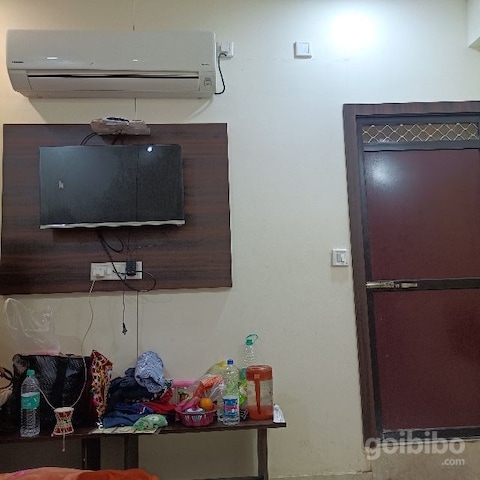
The image size is (480, 480). Find the location of `wall above window`. wall above window is located at coordinates (402, 59).